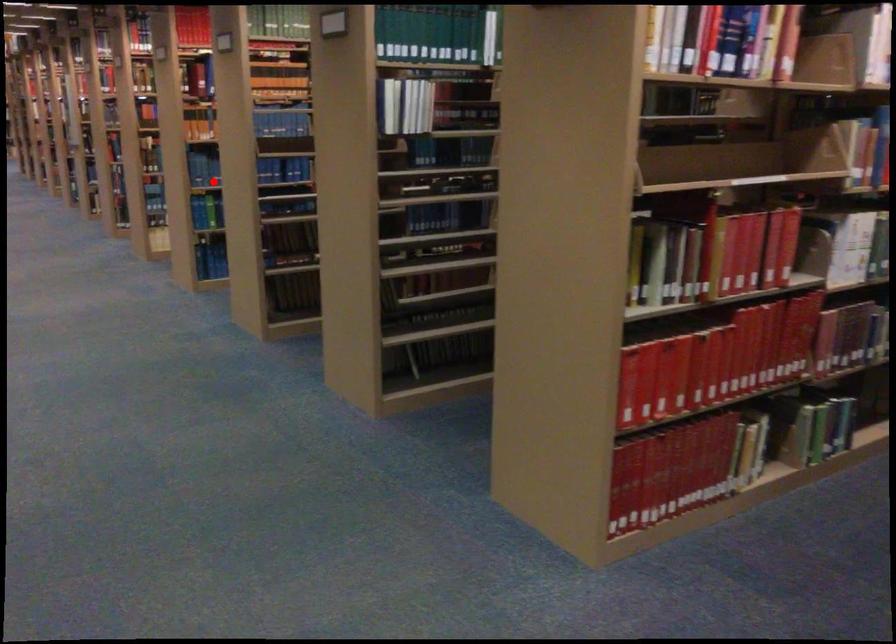
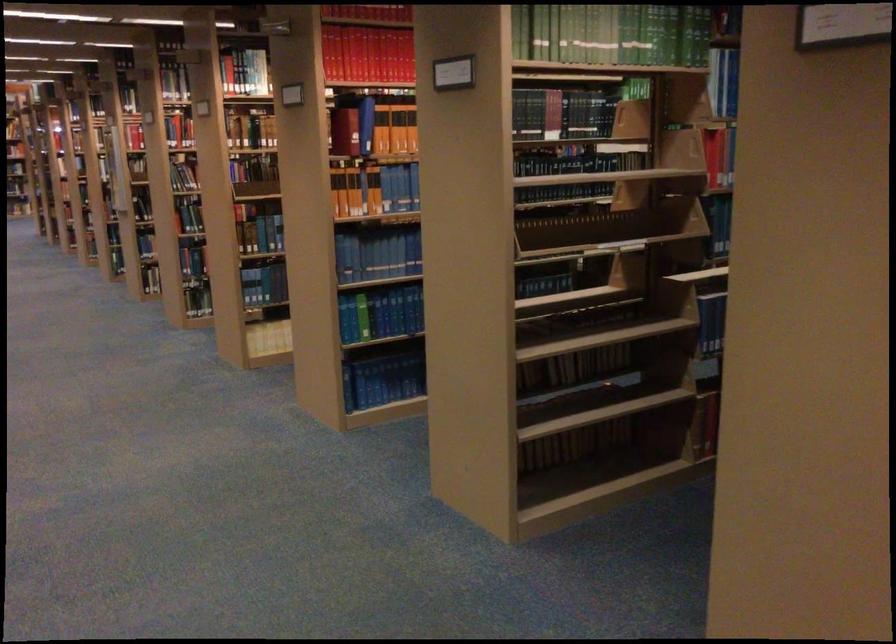
Locate, in the second image, the point that corresponds to the highlighted location in the first image.

(377, 254)